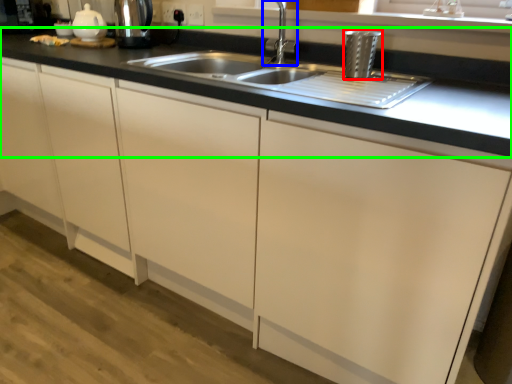
Question: Which is farther away from appliance (highlighted by a red box)? tap (highlighted by a blue box) or countertop (highlighted by a green box)?

Choices:
 (A) tap
 (B) countertop

Answer: (B)